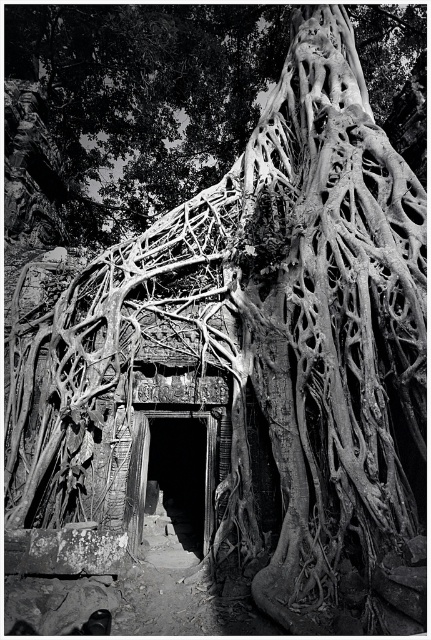
Is rough bark roots at center above dark stone doorway at center?

Yes, rough bark roots at center is above dark stone doorway at center.

How far apart are rough bark roots at center and dark stone doorway at center?

rough bark roots at center and dark stone doorway at center are 10.37 meters apart.

Between point (84, 216) and point (125, 492), which one is positioned in front?

Point (125, 492) is in front.

At what (x,y) coordinates should I click in order to perform the action: click on rough bark roots at center. Please return your answer as a coordinate pair (x, y). Looking at the image, I should click on (146, 93).